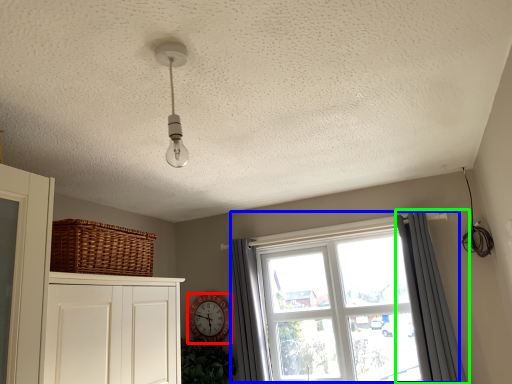
Question: Which object is positioned closest to clock (highlighted by a red box)? Select from window (highlighted by a blue box) and curtain (highlighted by a green box).

Choices:
 (A) window
 (B) curtain

Answer: (A)